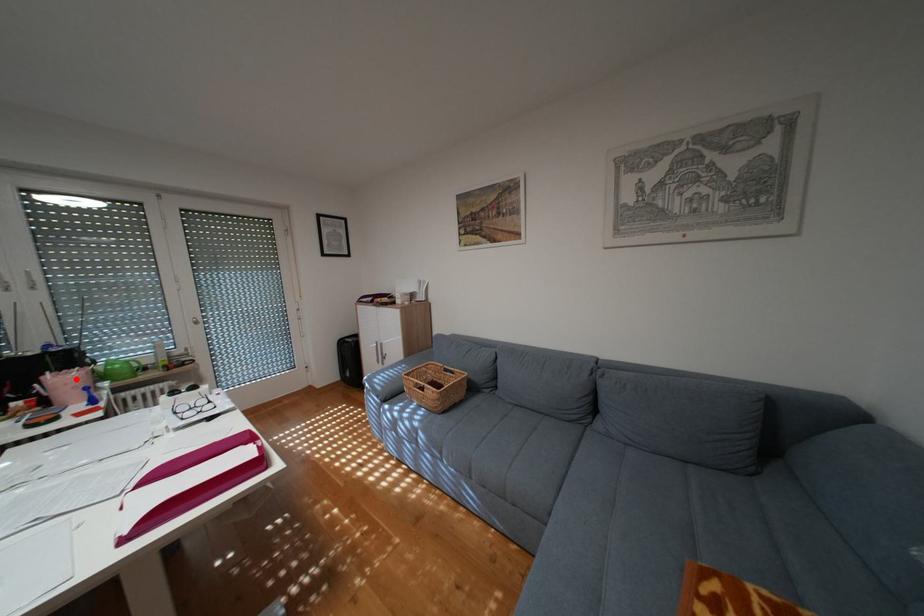
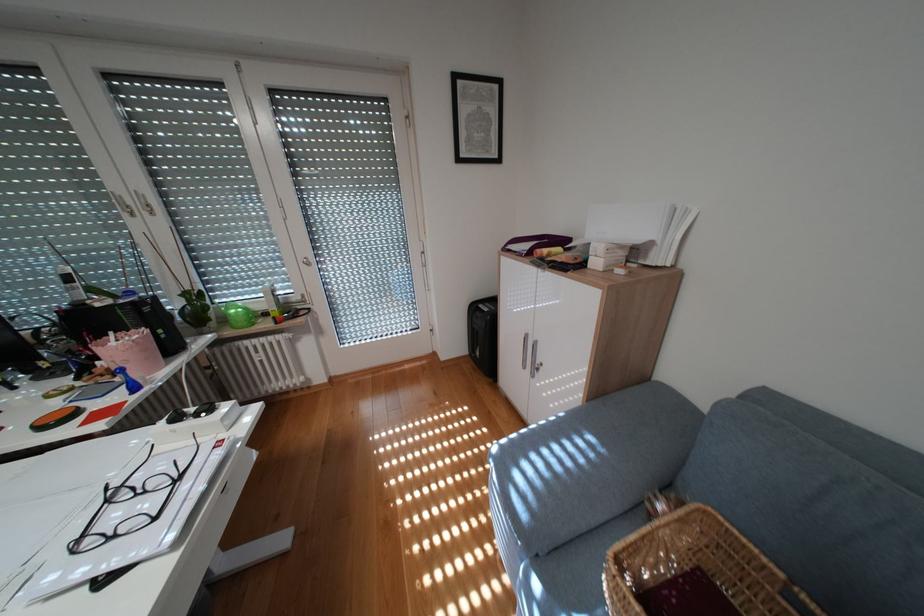
Locate, in the second image, the point that corresponds to the highlighted location in the first image.

(136, 345)